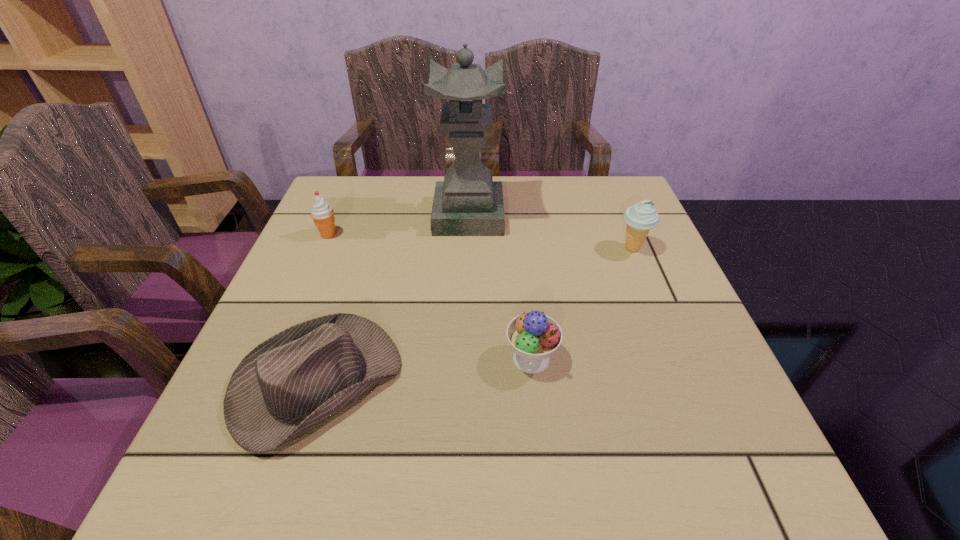
This screenshot has width=960, height=540. In order to click on free space between the rightmost icecream and the fedora in this screenshot , I will do `click(474, 315)`.

You are a GUI agent. You are given a task and a screenshot of the screen. Output one action in this format:
    pyautogui.click(x=<x>, y=<y>)
    Task: Click on the free space between the leftmost icecream and the second icecream from left to right
    Image resolution: width=960 pixels, height=540 pixels.
    Given the screenshot: What is the action you would take?
    pyautogui.click(x=430, y=297)

Select which object appears as the second closest to the leftmost icecream. Please provide its 2D coordinates. Your answer should be formatted as a tuple, i.e. [(x, y)], where the tuple contains the x and y coordinates of a point satisfying the conditions above.

[(289, 384)]

Identify which object is the fourth nearest to the rightmost object. Please provide its 2D coordinates. Your answer should be formatted as a tuple, i.e. [(x, y)], where the tuple contains the x and y coordinates of a point satisfying the conditions above.

[(322, 213)]

Identify which icecream is the second nearest to the fedora. Please provide its 2D coordinates. Your answer should be formatted as a tuple, i.e. [(x, y)], where the tuple contains the x and y coordinates of a point satisfying the conditions above.

[(322, 213)]

Locate which icecream ranks in proximity to the fedora. Please provide its 2D coordinates. Your answer should be formatted as a tuple, i.e. [(x, y)], where the tuple contains the x and y coordinates of a point satisfying the conditions above.

[(534, 336)]

Identify the location of vacant space that satisfies the following two spatial constraints: 1. on the front side of the fedora; 2. on the left side of the leftmost icecream. The image size is (960, 540). (266, 382).

The height and width of the screenshot is (540, 960). I want to click on free region that satisfies the following two spatial constraints: 1. on the front side of the fedora; 2. on the right side of the leftmost icecream, so click(266, 382).

You are a GUI agent. You are given a task and a screenshot of the screen. Output one action in this format:
    pyautogui.click(x=<x>, y=<y>)
    Task: Click on the vacant space that satisfies the following two spatial constraints: 1. at the front opening of the tallest object; 2. on the front side of the fedora
    The width and height of the screenshot is (960, 540).
    Given the screenshot: What is the action you would take?
    pyautogui.click(x=463, y=382)

Find the location of a particular element. vacant area that satisfies the following two spatial constraints: 1. on the front side of the leftmost icecream; 2. on the right side of the fedora is located at coordinates (266, 382).